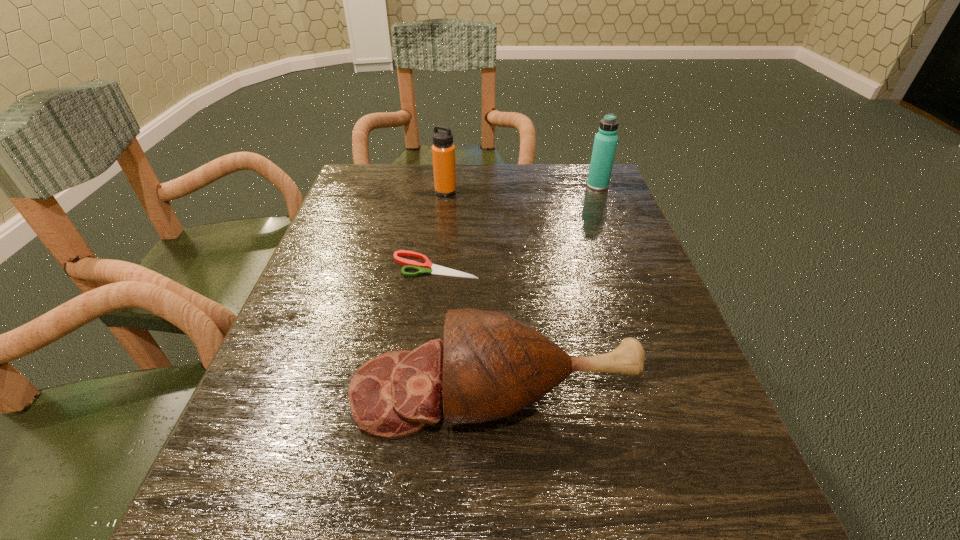
Where is `the right thermos bottle`? the right thermos bottle is located at coordinates (605, 142).

I want to click on the left thermos bottle, so click(443, 150).

The height and width of the screenshot is (540, 960). I want to click on ham, so click(490, 366).

Locate an element on the screen. The image size is (960, 540). the nearest object is located at coordinates (490, 366).

Where is `the shortest object`? The width and height of the screenshot is (960, 540). the shortest object is located at coordinates (425, 268).

Locate an element on the screen. Image resolution: width=960 pixels, height=540 pixels. the second nearest object is located at coordinates (425, 268).

The height and width of the screenshot is (540, 960). Identify the location of free space located on the left of the rightmost object. (469, 186).

Find the location of a particular element. The height and width of the screenshot is (540, 960). vacant space situated 0.320m on the front of the left thermos bottle is located at coordinates (436, 280).

Where is `blank space located at the sliced end of the nearest object`? blank space located at the sliced end of the nearest object is located at coordinates [x=266, y=392].

Find the location of a particular element. free region located at the sliced end of the nearest object is located at coordinates (311, 392).